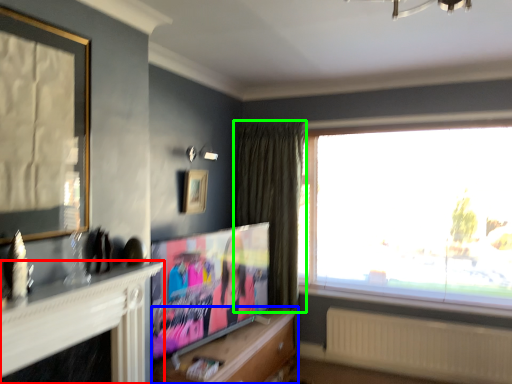
Question: Estimate the real-world distances between objects in this image. Which object is closer to fireplace (highlighted by a red box), cabinetry (highlighted by a blue box) or curtain (highlighted by a green box)?

Choices:
 (A) cabinetry
 (B) curtain

Answer: (A)